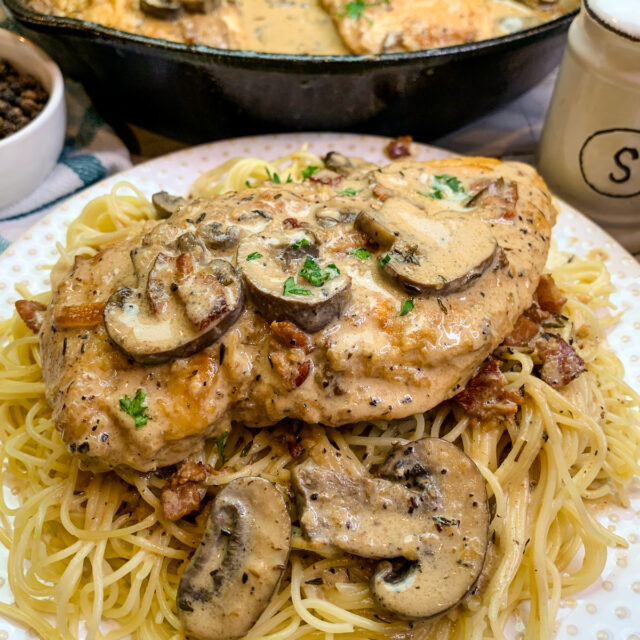
I want to click on plate, so click(x=176, y=166).